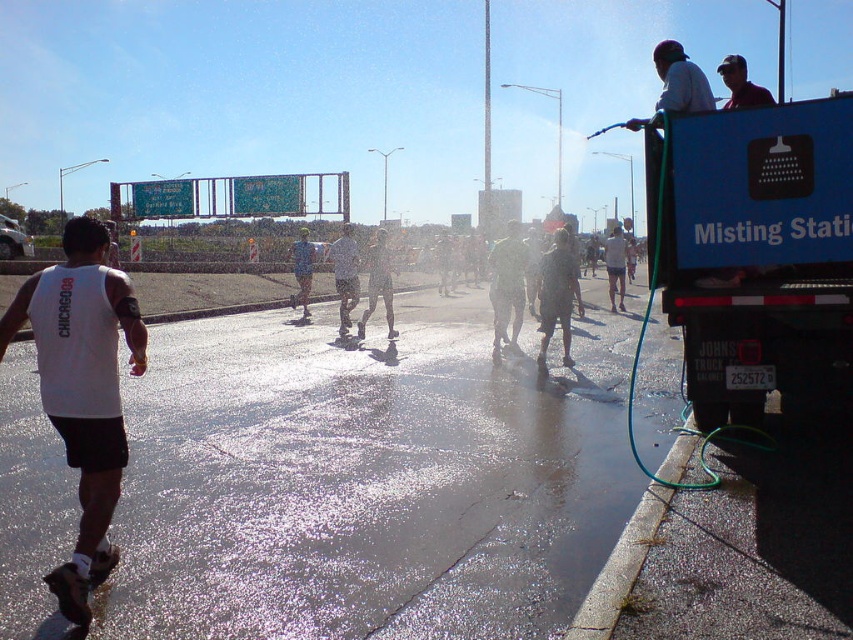
You are a photographer standing at the misting station on the right side of the road. You want to take a photo of two points marked in the scene. The first point is at coordinate point(544, 301) and the second is at point(753, 99). Which point will appear closer to the camera in your photo?

Point(544, 301) is further to the camera than point(753, 99), so the first point will appear closer to the camera in the photo.

You are a runner in the marathon and you want to cool down under the mist from the blue plastic truck at right. However, you notice a matte black shirt at upper right. Which direction should you move to reach the misting station first?

The blue plastic truck at right is to the left of the matte black shirt at upper right. Therefore, to reach the misting station first, you should move to the left direction.